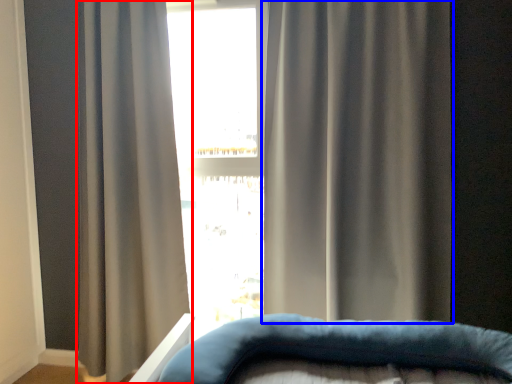
Question: Which object is further to the camera taking this photo, curtain (highlighted by a red box) or curtain (highlighted by a blue box)?

Choices:
 (A) curtain
 (B) curtain

Answer: (A)